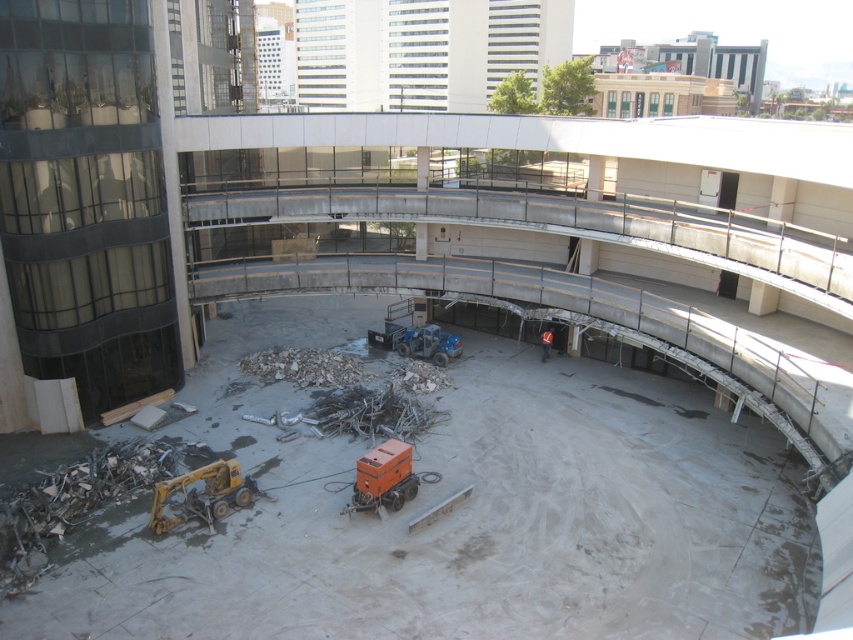
Is blue metallic forklift at center further to camera compared to orange reflective vest at center?

No, it is not.

How distant is blue metallic forklift at center from orange reflective vest at center?

blue metallic forklift at center is 21.15 feet away from orange reflective vest at center.

I want to click on blue metallic forklift at center, so click(x=416, y=333).

Between orange metallic generator at center and blue metallic forklift at center, which one is positioned lower?

Positioned lower is orange metallic generator at center.

Does orange metallic generator at center have a larger size compared to blue metallic forklift at center?

Actually, orange metallic generator at center might be smaller than blue metallic forklift at center.

Measure the distance between point (370, 452) and camera.

Point (370, 452) is 23.57 meters away from camera.

The height and width of the screenshot is (640, 853). I want to click on orange metallic generator at center, so click(x=386, y=477).

Does point (241, 477) come farther from viewer compared to point (442, 356)?

No, (241, 477) is in front of (442, 356).

The height and width of the screenshot is (640, 853). What do you see at coordinates (200, 493) in the screenshot? I see `yellow metallic excavator at lower left` at bounding box center [200, 493].

Find the location of a particular element. This screenshot has width=853, height=640. yellow metallic excavator at lower left is located at coordinates (200, 493).